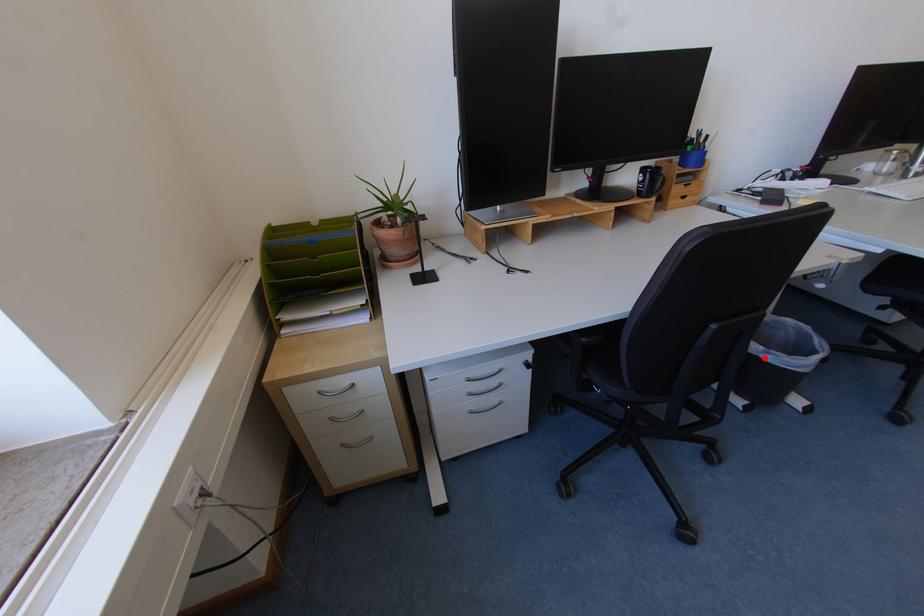
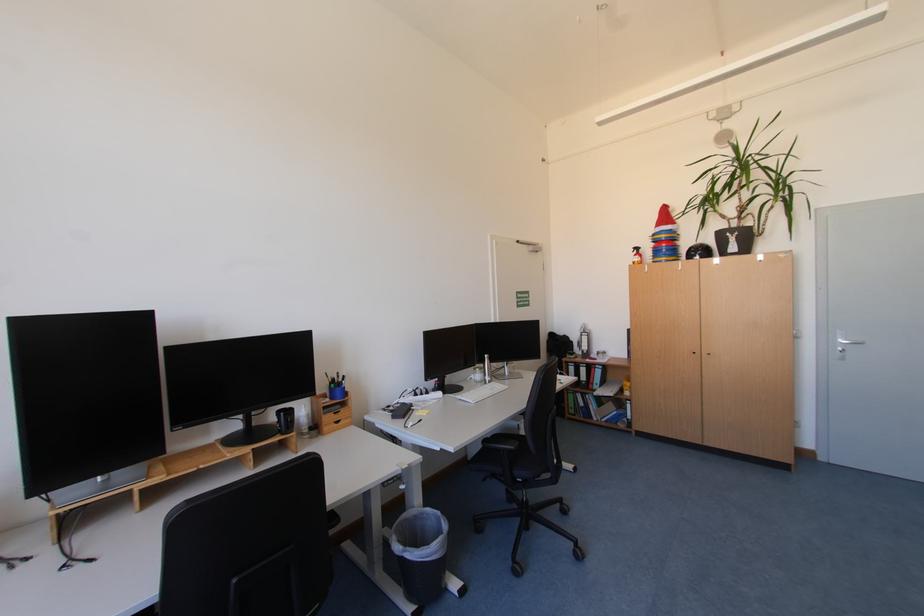
Question: I am providing you with two images of the same scene from different viewpoints. Given a red point in image1, look at the same physical point in image2. Is it:

Choices:
 (A) Closer to the viewpoint
 (B) Farther from the viewpoint

Answer: (A)